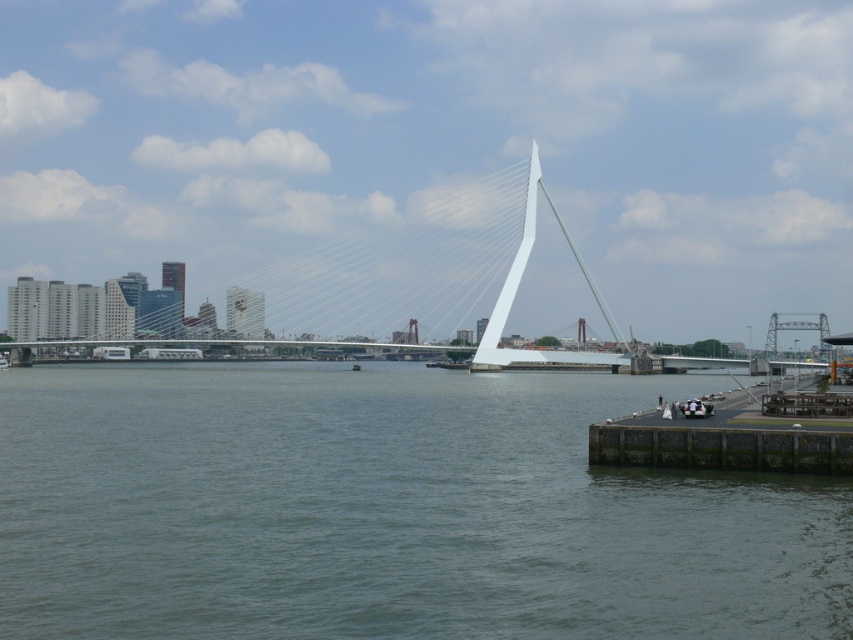
Question: Considering the real-world distances, which object is farthest from the dark gray concrete dock at lower right?

Choices:
 (A) metallic gray boat at lower left
 (B) greenish-blue water at center

Answer: (A)

Question: Estimate the real-world distances between objects in this image. Which object is closer to the greenish-blue water at center?

Choices:
 (A) dark gray concrete dock at lower right
 (B) metallic gray boat at lower left

Answer: (A)

Question: Considering the real-world distances, which object is closest to the metallic gray boat at lower left?

Choices:
 (A) greenish-blue water at center
 (B) dark gray concrete dock at lower right

Answer: (A)

Question: Does greenish-blue water at center come behind metallic gray boat at lower left?

Choices:
 (A) no
 (B) yes

Answer: (A)

Question: Is greenish-blue water at center smaller than dark gray concrete dock at lower right?

Choices:
 (A) yes
 (B) no

Answer: (B)

Question: Does greenish-blue water at center have a lesser width compared to metallic gray boat at lower left?

Choices:
 (A) no
 (B) yes

Answer: (A)